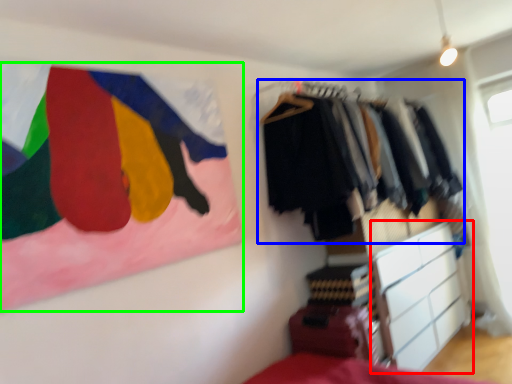
Question: Based on their relative distances, which object is farther from chest of drawers (highlighted by a red box)? Choose from closet (highlighted by a blue box) and flag (highlighted by a green box).

Choices:
 (A) closet
 (B) flag

Answer: (B)